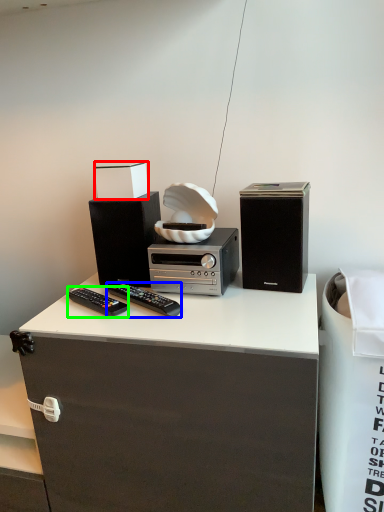
Question: Estimate the real-world distances between objects in this image. Which object is closer to box (highlighted by a red box), remote control (highlighted by a blue box) or remote control (highlighted by a green box)?

Choices:
 (A) remote control
 (B) remote control

Answer: (A)